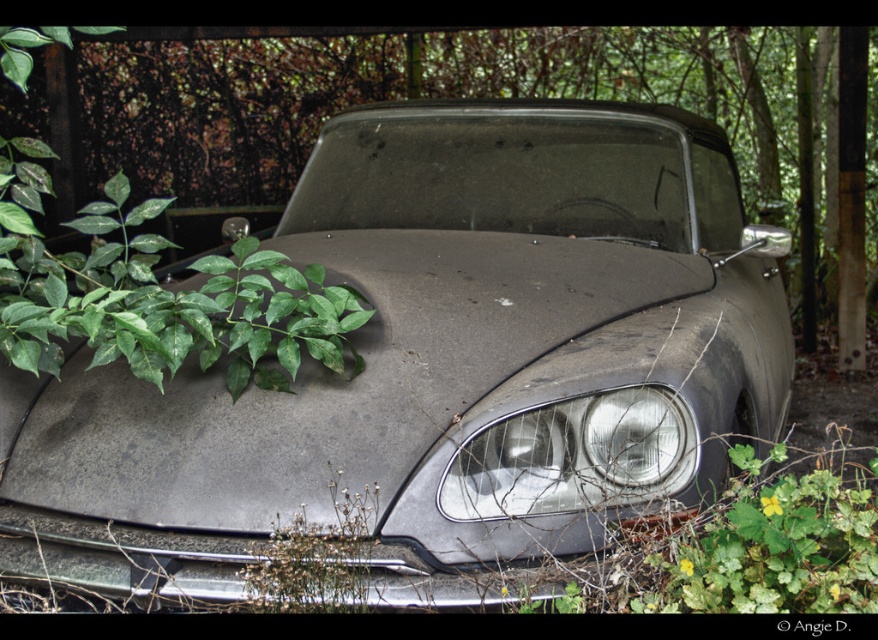
Between matte gray car at center and green leafy plant at left, which one appears on the right side from the viewer's perspective?

matte gray car at center is more to the right.

Is matte gray car at center to the right of green leafy plant at left from the viewer's perspective?

Indeed, matte gray car at center is positioned on the right side of green leafy plant at left.

What do you see at coordinates (439, 364) in the screenshot? I see `matte gray car at center` at bounding box center [439, 364].

Locate an element on the screen. The width and height of the screenshot is (878, 640). matte gray car at center is located at coordinates (439, 364).

Does point (380, 202) come behind point (538, 464)?

Yes, point (380, 202) is behind point (538, 464).

Is matte gray car at center wider than matte gray headlight at center?

Indeed, matte gray car at center has a greater width compared to matte gray headlight at center.

Is point (769, 268) more distant than point (652, 464)?

Yes.

Find the location of `matte gray car at center`. matte gray car at center is located at coordinates (439, 364).

Between green leafy plant at left and matte gray headlight at center, which one appears on the right side from the viewer's perspective?

Positioned to the right is matte gray headlight at center.

Does green leafy plant at left appear over matte gray headlight at center?

Yes, green leafy plant at left is above matte gray headlight at center.

Between point (49, 99) and point (531, 496), which one is positioned behind?

Point (49, 99)

Image resolution: width=878 pixels, height=640 pixels. In order to click on green leafy plant at left in this screenshot , I will do pyautogui.click(x=423, y=97).